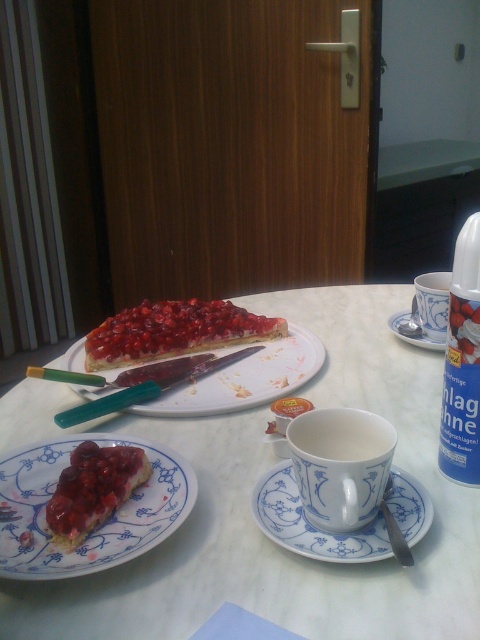
Question: Is blue porcelain saucer at center smaller than white ceramic mug at upper center?

Choices:
 (A) yes
 (B) no

Answer: (A)

Question: Considering the real-world distances, which object is farthest from the white ceramic mug at center?

Choices:
 (A) white porcelain plate at center
 (B) blue porcelain saucer at center

Answer: (A)

Question: Which object appears closest to the camera in this image?

Choices:
 (A) white ceramic mug at center
 (B) blue porcelain saucer at center

Answer: (A)

Question: Is white ceramic mug at center bigger than shiny red fruit tart at center?

Choices:
 (A) yes
 (B) no

Answer: (B)

Question: Does blue porcelain saucer at center appear under white porcelain saucer at center?

Choices:
 (A) no
 (B) yes

Answer: (B)

Question: Which of the following is the closest to the observer?

Choices:
 (A) (47, 512)
 (B) (427, 291)

Answer: (A)